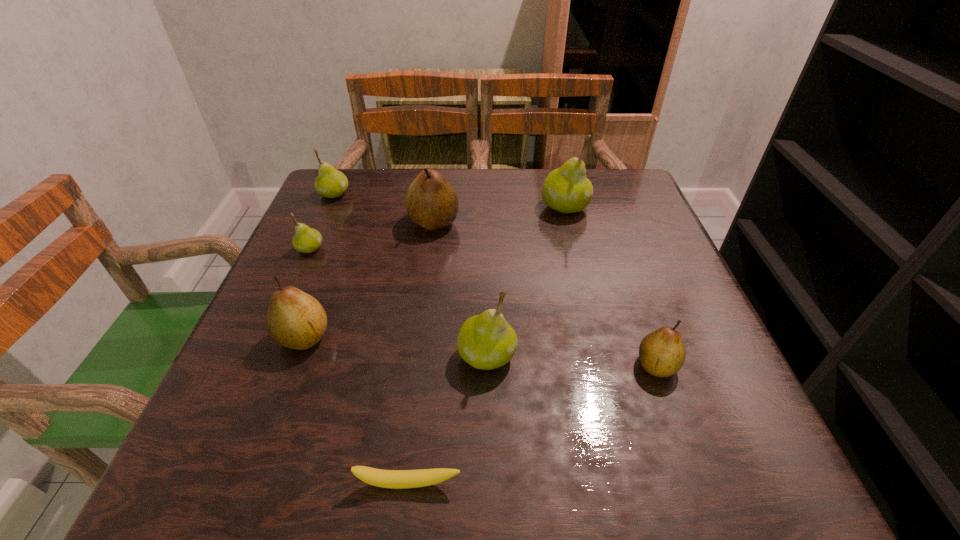
What are the coordinates of `object that is at the near edge` in the screenshot? It's located at (394, 479).

The width and height of the screenshot is (960, 540). Find the location of `object that is positioned at the far left corner`. object that is positioned at the far left corner is located at coordinates (331, 183).

I want to click on object that is at the far right corner, so click(x=567, y=189).

This screenshot has width=960, height=540. Identify the location of vacant space at the far edge of the desktop. (487, 171).

Image resolution: width=960 pixels, height=540 pixels. I want to click on free region at the near edge of the desktop, so click(x=652, y=449).

I want to click on vacant space at the left edge of the desktop, so click(x=269, y=409).

This screenshot has width=960, height=540. I want to click on free space at the right edge of the desktop, so [x=632, y=263].

In the image, there is a desktop. Identify the location of vacant space at the far left corner. The image size is (960, 540). (334, 202).

This screenshot has height=540, width=960. I want to click on vacant space at the near left corner, so click(211, 463).

Where is `free space at the far right corner`? This screenshot has width=960, height=540. free space at the far right corner is located at coordinates (597, 178).